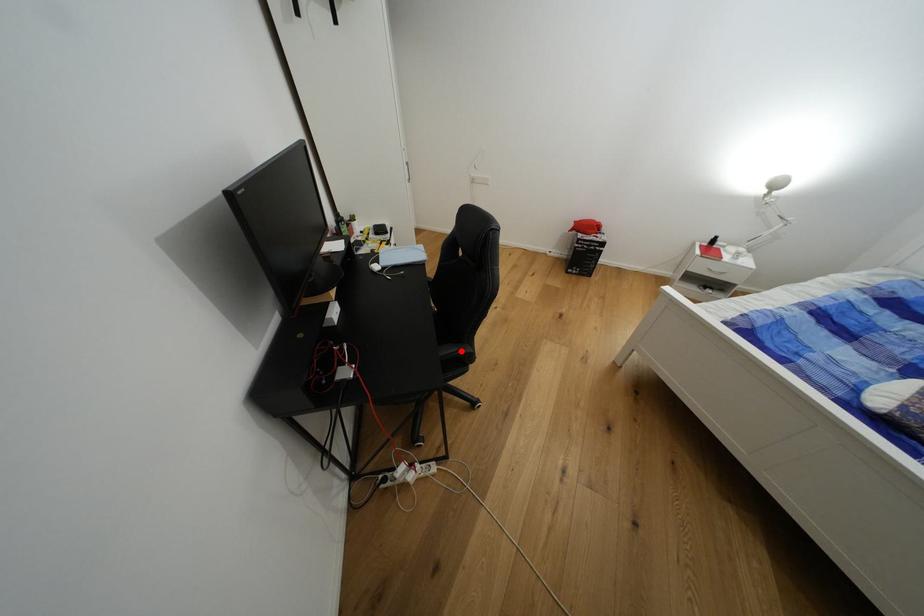
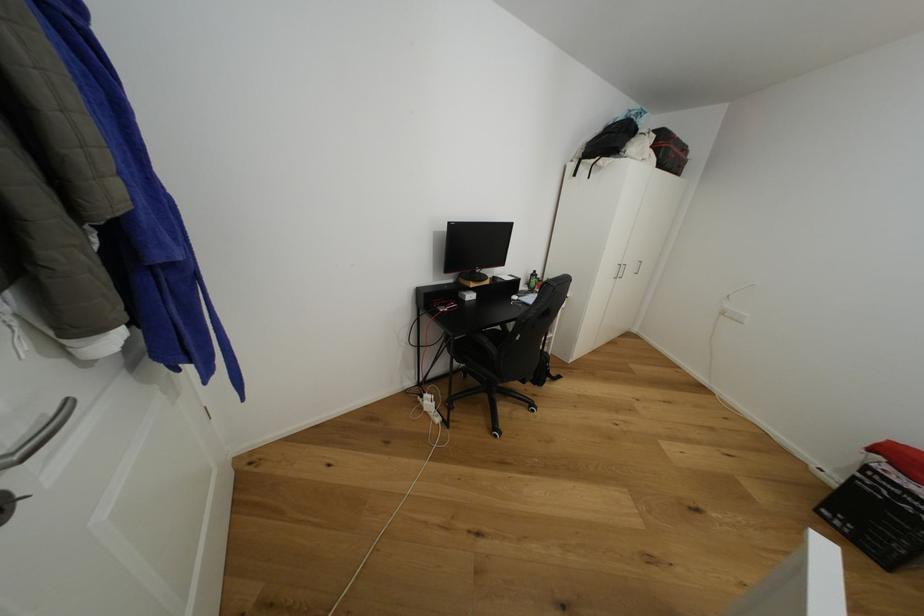
In the second image, find the point that corresponds to the highlighted location in the first image.

(491, 342)